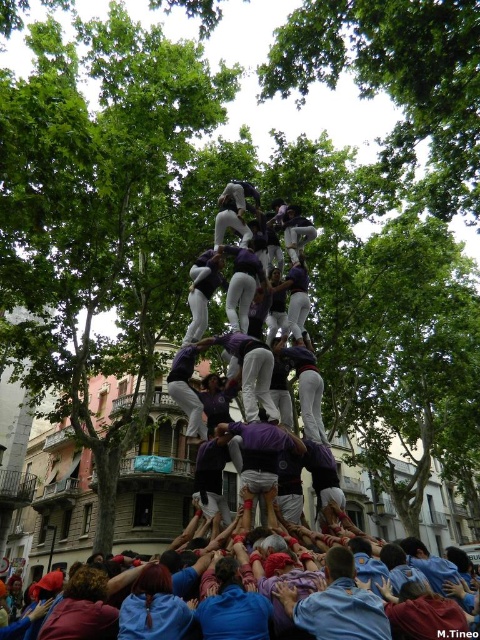
Can you confirm if blue cotton shirt at lower center is shorter than blue fabric crowd at lower center?

Yes, blue cotton shirt at lower center is shorter than blue fabric crowd at lower center.

Describe the element at coordinates (336, 604) in the screenshot. I see `blue cotton shirt at lower center` at that location.

I want to click on blue cotton shirt at lower center, so tap(336, 604).

Identify the location of blue cotton shirt at lower center. This screenshot has width=480, height=640. pos(336,604).

Is green leafy tree at upper center positioned behind blue fabric crowd at lower center?

Yes, it is behind blue fabric crowd at lower center.

Is green leafy tree at upper center above blue fabric crowd at lower center?

Yes.

Is point (392, 22) positioned before point (394, 602)?

No, (392, 22) is further to viewer.

Find the location of a particular element. This screenshot has width=480, height=640. green leafy tree at upper center is located at coordinates (396, 80).

Does point (406, 129) come closer to viewer compared to point (327, 572)?

No, (406, 129) is further to viewer.

Is the position of green leafy tree at upper center less distant than that of blue cotton shirt at lower center?

No, green leafy tree at upper center is further to the viewer.

You are a GUI agent. You are given a task and a screenshot of the screen. Output one action in this format:
    pyautogui.click(x=<x>, y=<y>)
    Task: Click on the green leafy tree at upper center
    This screenshot has height=640, width=480.
    Given the screenshot: What is the action you would take?
    pyautogui.click(x=396, y=80)

Where is `green leafy tree at upper center`? green leafy tree at upper center is located at coordinates (396, 80).